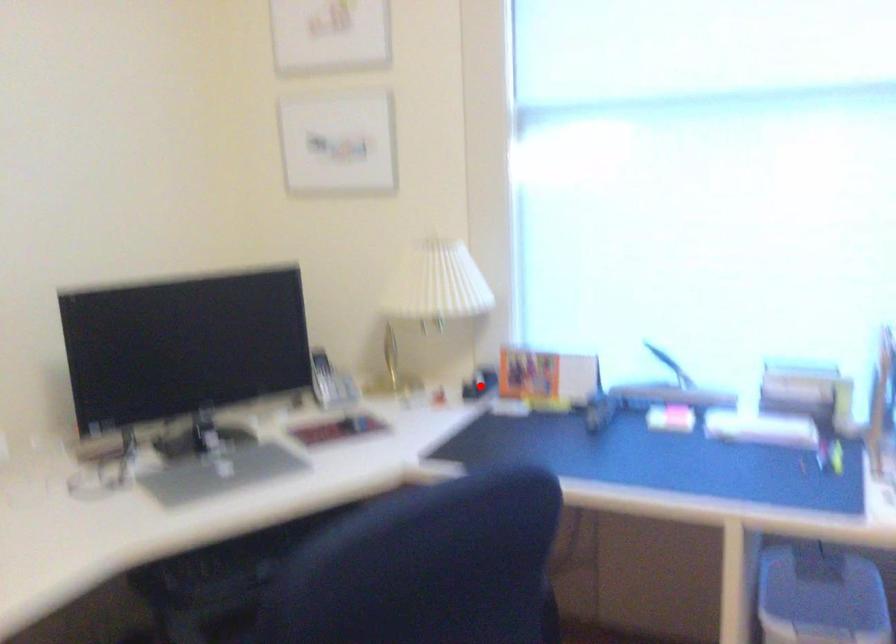
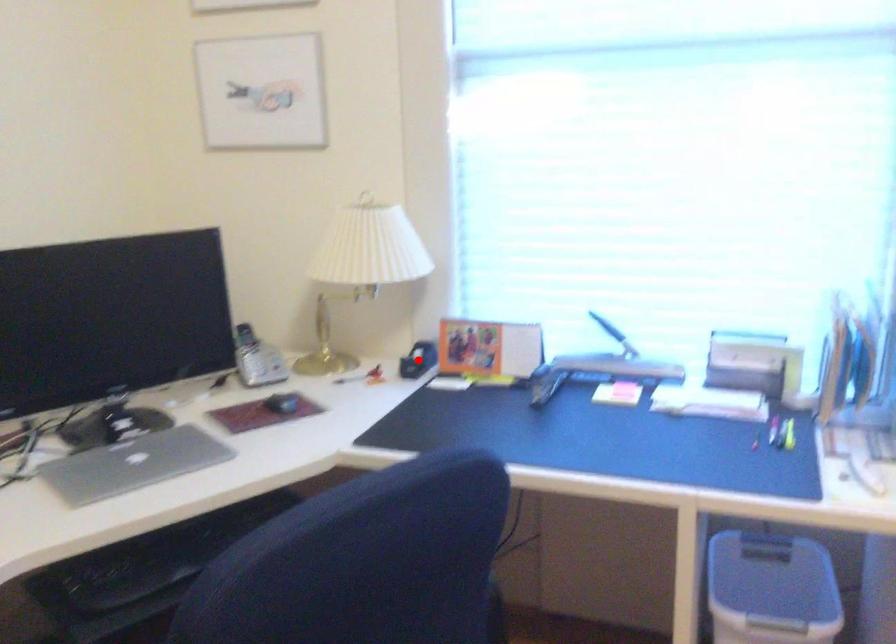
I am providing you with two images of the same scene from different viewpoints. A red point is marked on the first image and another point is marked on the second image. Is the marked point in image1 the same physical position as the marked point in image2?

Yes